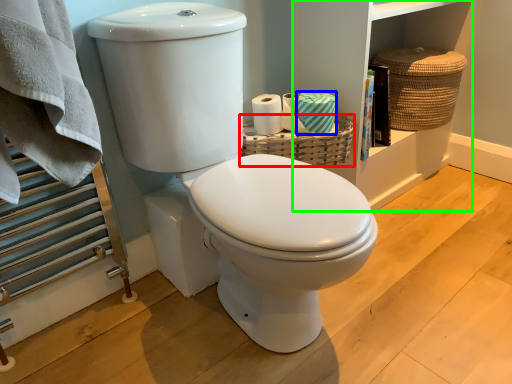
Question: Estimate the real-world distances between objects in this image. Which object is farther from basket (highlighted by a red box), toilet paper (highlighted by a blue box) or bookshelf (highlighted by a green box)?

Choices:
 (A) toilet paper
 (B) bookshelf

Answer: (B)